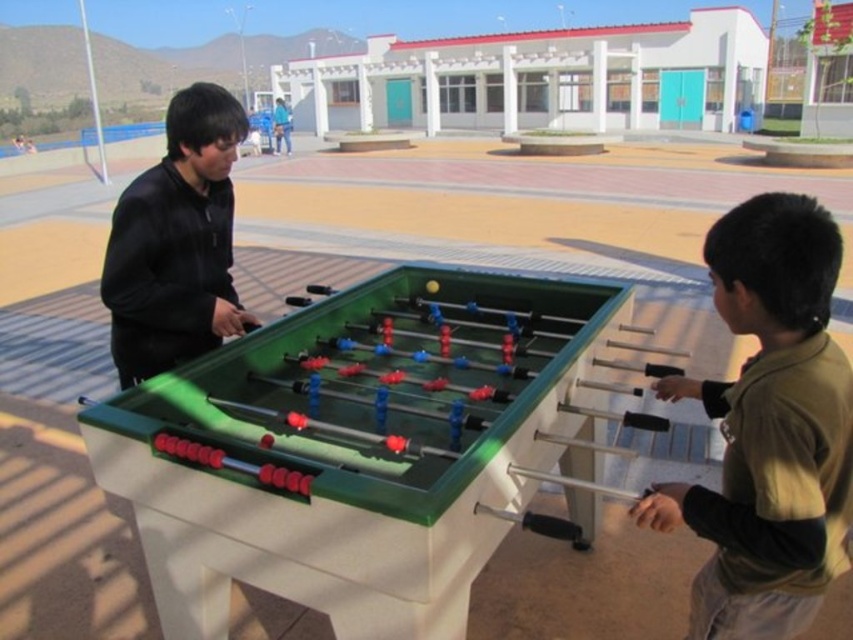
Question: Does light brown fleece jacket at lower right have a larger size compared to black matte jacket at center?

Choices:
 (A) yes
 (B) no

Answer: (B)

Question: Considering the relative positions of light brown fleece jacket at lower right and black matte jacket at center in the image provided, where is light brown fleece jacket at lower right located with respect to black matte jacket at center?

Choices:
 (A) above
 (B) below

Answer: (B)

Question: Observing the image, what is the correct spatial positioning of light brown fleece jacket at lower right in reference to black matte jacket at center?

Choices:
 (A) left
 (B) right

Answer: (B)

Question: Which object is closer to the camera taking this photo?

Choices:
 (A) black matte jacket at center
 (B) light brown fleece jacket at lower right

Answer: (B)